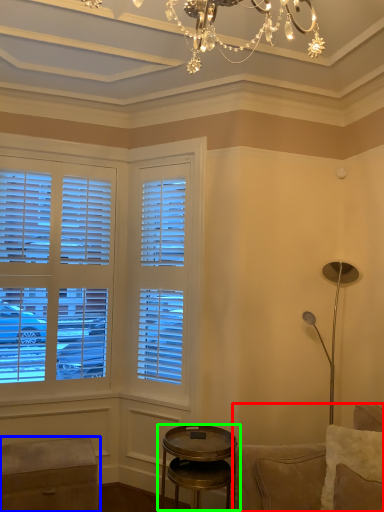
Question: Which is farther away from studio couch (highlighted by a red box)? music stool (highlighted by a blue box) or table (highlighted by a green box)?

Choices:
 (A) music stool
 (B) table

Answer: (A)